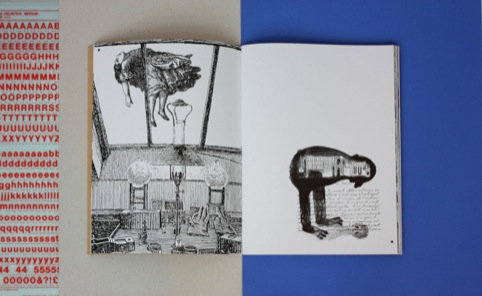
In order to click on lower case letter sticker sheet in this screenshot , I will do `click(26, 224)`.